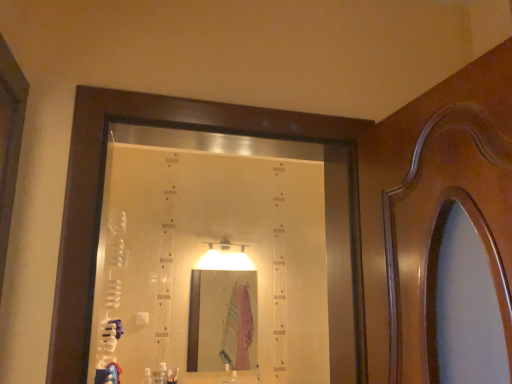
Measure the distance between point (164, 376) and camera.

They are 2.88 meters apart.

What is the approximate width of white plastic bottle at lower center, positioned as the first toiletry in left-to-right order?

The width of white plastic bottle at lower center, positioned as the first toiletry in left-to-right order, is 3.54 inches.

What do you see at coordinates (222, 320) in the screenshot? I see `pink fabric at center` at bounding box center [222, 320].

Identify the location of blue cotton robe at lower left. This screenshot has height=384, width=512. (108, 374).

From a real-world perspective, starting from the blue cotton robe at lower left, which toiletry is the 1st one below it? Please provide its 2D coordinates.

[(163, 373)]

Is clear plastic bottle at lower center, the 1th toiletry when ordered from right to left, smaller than blue cotton robe at lower left?

Yes.

Consider the image. From the image's perspective, between clear plastic bottle at lower center, the 2th toiletry when ordered from left to right, and blue cotton robe at lower left, who is located below?

clear plastic bottle at lower center, the 2th toiletry when ordered from left to right, is shown below in the image.

Would you say white plastic bottle at lower center, positioned as the first toiletry in left-to-right order, is to the left or to the right of pink fabric at center in the picture?

Based on their positions, white plastic bottle at lower center, positioned as the first toiletry in left-to-right order, is located to the left of pink fabric at center.

In terms of size, does white plastic bottle at lower center, positioned as the first toiletry in left-to-right order, appear bigger or smaller than pink fabric at center?

In the image, white plastic bottle at lower center, positioned as the first toiletry in left-to-right order, appears to be smaller than pink fabric at center.

Does white plastic bottle at lower center, which is the second toiletry from right to left, turn towards pink fabric at center?

No, white plastic bottle at lower center, which is the second toiletry from right to left, does not turn towards pink fabric at center.

At what (x,y) coordinates should I click in order to perform the action: click on mirror on the right of white plastic bottle at lower center, which is the second toiletry from right to left. Please return your answer as a coordinate pair (x, y). Looking at the image, I should click on (222, 320).

From a real-world perspective, is white plastic bottle at lower center, positioned as the first toiletry in left-to-right order, over clear plastic bottle at lower center, the 1th toiletry when ordered from right to left?

No.

Considering the sizes of objects white plastic bottle at lower center, positioned as the first toiletry in left-to-right order, and clear plastic bottle at lower center, the 2th toiletry when ordered from left to right, in the image provided, who is smaller, white plastic bottle at lower center, positioned as the first toiletry in left-to-right order, or clear plastic bottle at lower center, the 2th toiletry when ordered from left to right,?

white plastic bottle at lower center, positioned as the first toiletry in left-to-right order.

Which is closer to the camera, (145,376) or (164,362)?

Point (145,376)

Which of these two, blue cotton robe at lower left or pink fabric at center, stands shorter?

Standing shorter between the two is blue cotton robe at lower left.

What are the coordinates of `mirror lying behind the blue cotton robe at lower left` in the screenshot? It's located at (222, 320).

Can you confirm if blue cotton robe at lower left is smaller than pink fabric at center?

Yes, blue cotton robe at lower left is smaller than pink fabric at center.

In the scene shown: Is blue cotton robe at lower left positioned in front of pink fabric at center?

Yes, blue cotton robe at lower left is in front of pink fabric at center.

Can clear plastic bottle at lower center, the 1th toiletry when ordered from right to left, be found inside blue cotton robe at lower left?

No, clear plastic bottle at lower center, the 1th toiletry when ordered from right to left, is not inside blue cotton robe at lower left.

Is blue cotton robe at lower left thinner than clear plastic bottle at lower center, the 2th toiletry when ordered from left to right?

Incorrect, the width of blue cotton robe at lower left is not less than that of clear plastic bottle at lower center, the 2th toiletry when ordered from left to right.

Which object is more forward, blue cotton robe at lower left or clear plastic bottle at lower center, the 1th toiletry when ordered from right to left?

Positioned in front is blue cotton robe at lower left.

Is blue cotton robe at lower left shorter than clear plastic bottle at lower center, the 2th toiletry when ordered from left to right?

Indeed, blue cotton robe at lower left has a lesser height compared to clear plastic bottle at lower center, the 2th toiletry when ordered from left to right.

Considering the relative sizes of pink fabric at center and clear plastic bottle at lower center, the 2th toiletry when ordered from left to right, in the image provided, is pink fabric at center smaller than clear plastic bottle at lower center, the 2th toiletry when ordered from left to right,?

Actually, pink fabric at center might be larger than clear plastic bottle at lower center, the 2th toiletry when ordered from left to right.

Could clear plastic bottle at lower center, the 1th toiletry when ordered from right to left, be considered to be inside pink fabric at center?

That's incorrect, clear plastic bottle at lower center, the 1th toiletry when ordered from right to left, is not inside pink fabric at center.

Is pink fabric at center positioned far away from clear plastic bottle at lower center, the 1th toiletry when ordered from right to left?

They are positioned close to each other.

In order to click on the 1st toiletry below the pink fabric at center (from a real-world perspective) in this screenshot , I will do `click(163, 373)`.

Who is smaller, clear plastic bottle at lower center, the 1th toiletry when ordered from right to left, or pink fabric at center?

clear plastic bottle at lower center, the 1th toiletry when ordered from right to left, is smaller.

Is clear plastic bottle at lower center, the 2th toiletry when ordered from left to right, oriented towards pink fabric at center?

No.

Consider the image. Is clear plastic bottle at lower center, the 2th toiletry when ordered from left to right, completely or partially outside of pink fabric at center?

That's correct, clear plastic bottle at lower center, the 2th toiletry when ordered from left to right, is outside of pink fabric at center.

Between clear plastic bottle at lower center, the 1th toiletry when ordered from right to left, and pink fabric at center, which one is positioned in front?

clear plastic bottle at lower center, the 1th toiletry when ordered from right to left, is more forward.

Identify the location of the 2nd toiletry to the right of the blue cotton robe at lower left, starting your count from the anchor. The height and width of the screenshot is (384, 512). (163, 373).

Find the location of a particular element. This screenshot has width=512, height=384. toiletry that is the 2nd one when counting leftward from the pink fabric at center is located at coordinates (147, 376).

Looking at the image, which one is located further to blue cotton robe at lower left, white plastic bottle at lower center, which is the second toiletry from right to left, or clear plastic bottle at lower center, the 2th toiletry when ordered from left to right?

clear plastic bottle at lower center, the 2th toiletry when ordered from left to right, is further to blue cotton robe at lower left.

Based on their spatial positions, is white plastic bottle at lower center, positioned as the first toiletry in left-to-right order, or pink fabric at center further from clear plastic bottle at lower center, the 2th toiletry when ordered from left to right?

The object further to clear plastic bottle at lower center, the 2th toiletry when ordered from left to right, is pink fabric at center.

Based on their spatial positions, is clear plastic bottle at lower center, the 2th toiletry when ordered from left to right, or white plastic bottle at lower center, which is the second toiletry from right to left, closer to pink fabric at center?

Based on the image, clear plastic bottle at lower center, the 2th toiletry when ordered from left to right, appears to be nearer to pink fabric at center.

Estimate the real-world distances between objects in this image. Which object is further from white plastic bottle at lower center, positioned as the first toiletry in left-to-right order, pink fabric at center or blue cotton robe at lower left?

Among the two, pink fabric at center is located further to white plastic bottle at lower center, positioned as the first toiletry in left-to-right order.

Which object lies further to the anchor point pink fabric at center, blue cotton robe at lower left or clear plastic bottle at lower center, the 2th toiletry when ordered from left to right?

Based on the image, blue cotton robe at lower left appears to be further to pink fabric at center.

Based on their spatial positions, is clear plastic bottle at lower center, the 2th toiletry when ordered from left to right, or pink fabric at center closer to white plastic bottle at lower center, which is the second toiletry from right to left?

Based on the image, clear plastic bottle at lower center, the 2th toiletry when ordered from left to right, appears to be nearer to white plastic bottle at lower center, which is the second toiletry from right to left.

Estimate the real-world distances between objects in this image. Which object is closer to pink fabric at center, clear plastic bottle at lower center, the 2th toiletry when ordered from left to right, or blue cotton robe at lower left?

clear plastic bottle at lower center, the 2th toiletry when ordered from left to right.

Looking at the image, which one is located closer to clear plastic bottle at lower center, the 1th toiletry when ordered from right to left, blue cotton robe at lower left or white plastic bottle at lower center, which is the second toiletry from right to left?

white plastic bottle at lower center, which is the second toiletry from right to left, is closer to clear plastic bottle at lower center, the 1th toiletry when ordered from right to left.

Identify the location of toiletry between blue cotton robe at lower left and white plastic bottle at lower center, which is the second toiletry from right to left, in the front-back direction. This screenshot has height=384, width=512. (163, 373).

Find the location of `toiletry between white plastic bottle at lower center, which is the second toiletry from right to left, and pink fabric at center`. toiletry between white plastic bottle at lower center, which is the second toiletry from right to left, and pink fabric at center is located at coordinates (163, 373).